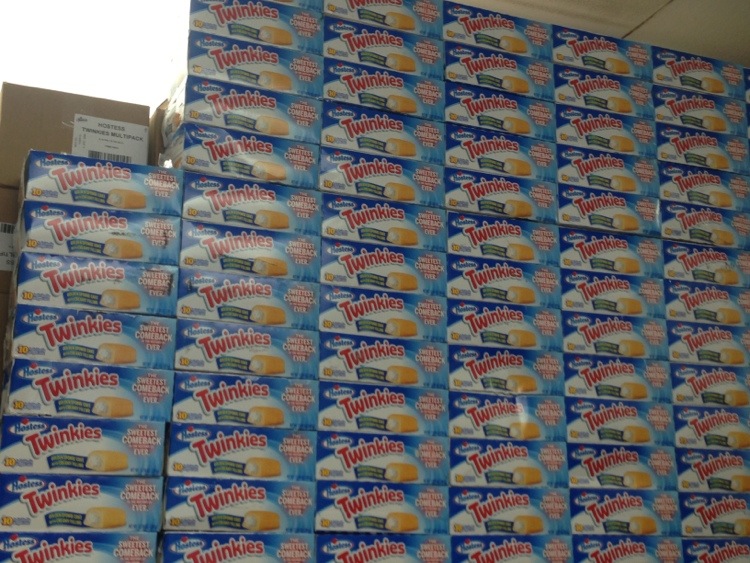
Identify the location of ceiling tile. (583, 12), (700, 25).